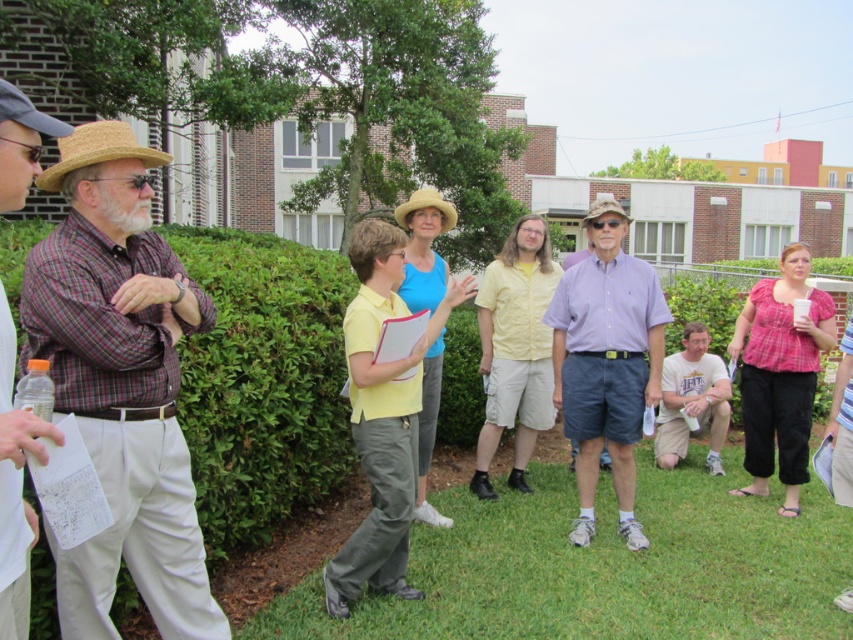
Question: Does light yellow straw hat at center appear over straw hat at center?

Choices:
 (A) no
 (B) yes

Answer: (A)

Question: Which object is the farthest from the straw hat at upper left?

Choices:
 (A) plaid cotton shirt at left
 (B) light yellow straw hat at center
 (C) plaid fabric shirt at left
 (D) striped cotton shirt at center

Answer: (D)

Question: Which object appears closest to the camera in this image?

Choices:
 (A) plaid cotton shirt at left
 (B) straw hat at center
 (C) striped cotton shirt at center
 (D) plaid fabric shirt at left

Answer: (D)

Question: Where is plaid fabric shirt at left located in relation to strawhat at left in the image?

Choices:
 (A) above
 (B) below

Answer: (B)

Question: Which point is farther from the camera taking this photo?

Choices:
 (A) [846, 460]
 (B) [610, 200]

Answer: (B)

Question: Is green grass at lower center positioned in front of straw hat at center?

Choices:
 (A) yes
 (B) no

Answer: (A)